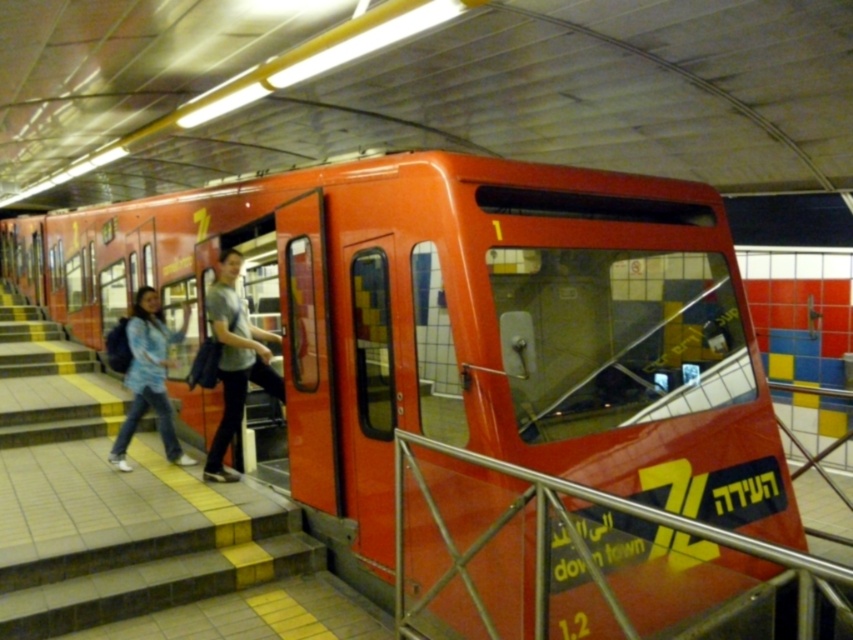
Which is below, metallic red train at center or blue denim jacket at left?

Positioned lower is blue denim jacket at left.

Find the location of `metallic red train at center`. metallic red train at center is located at coordinates (460, 324).

Find the location of a particular element. The height and width of the screenshot is (640, 853). metallic red train at center is located at coordinates (460, 324).

Is point (395, 452) farther from camera compared to point (222, 272)?

No, (395, 452) is in front of (222, 272).

Where is `metallic silver rail at lower right`? The height and width of the screenshot is (640, 853). metallic silver rail at lower right is located at coordinates (579, 541).

Is point (680, 612) more distant than point (480, 536)?

No, (680, 612) is closer to viewer.

Does metallic red train at center appear over metallic silver rail at lower right?

Yes, metallic red train at center is above metallic silver rail at lower right.

Is point (173, 266) more distant than point (606, 502)?

Yes, it is.

Where is `metallic red train at center`? The width and height of the screenshot is (853, 640). metallic red train at center is located at coordinates (460, 324).